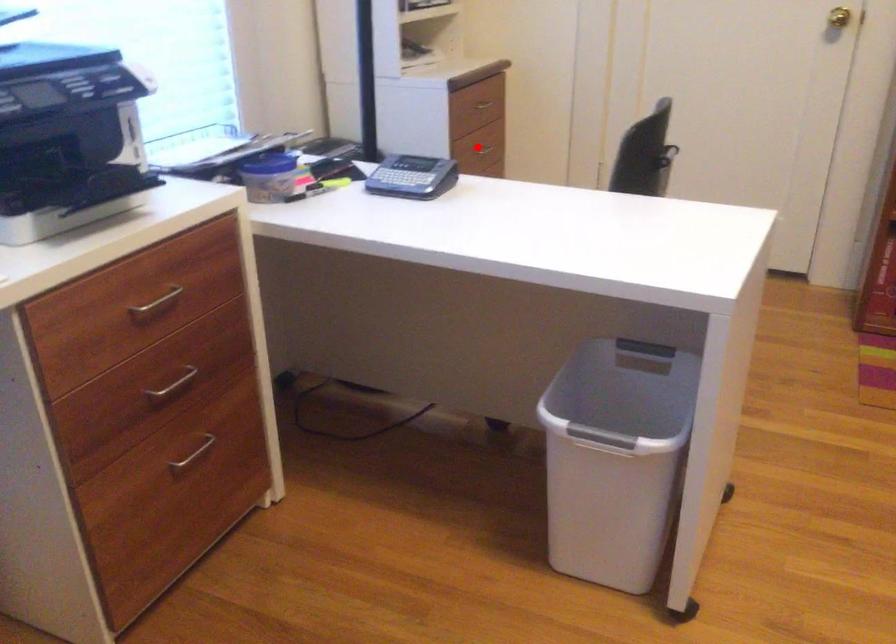
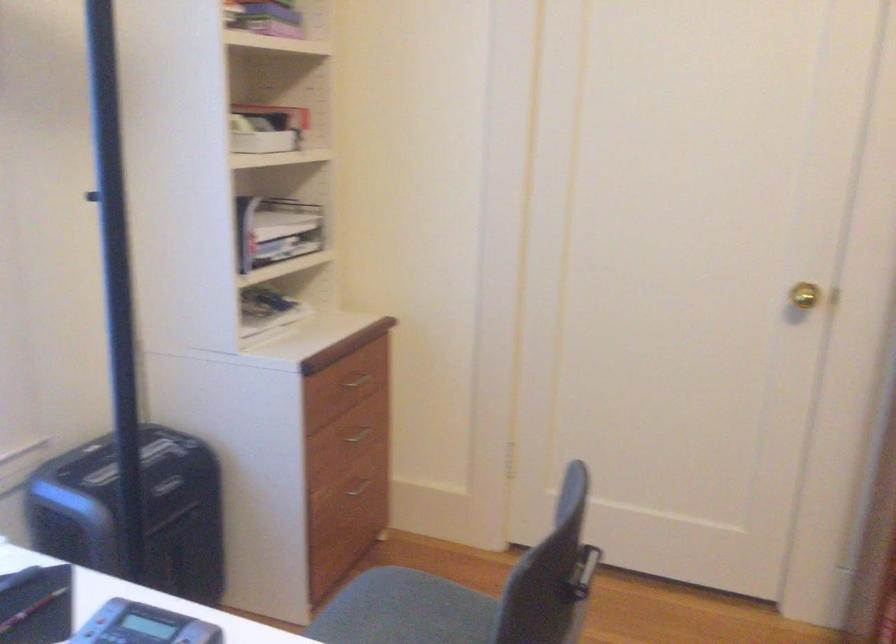
Find the pixel in the second image that matches the highlighted location in the first image.

(357, 431)